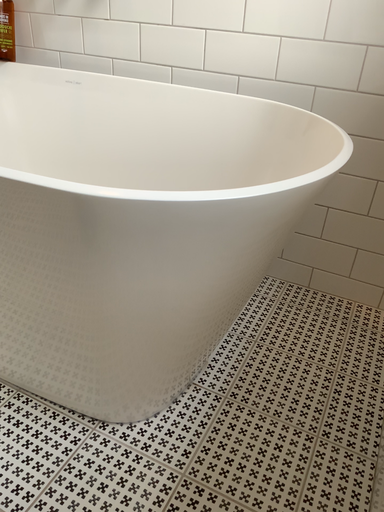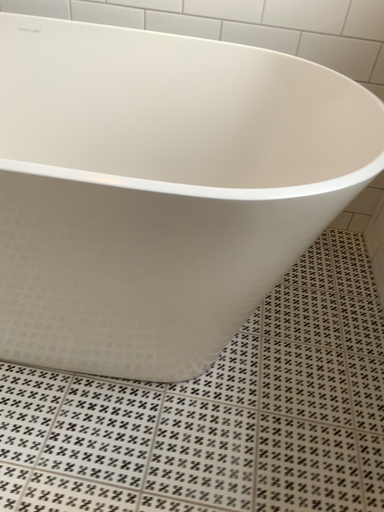
Question: Which way did the camera rotate in the video?

Choices:
 (A) rotated downward
 (B) rotated upward

Answer: (A)